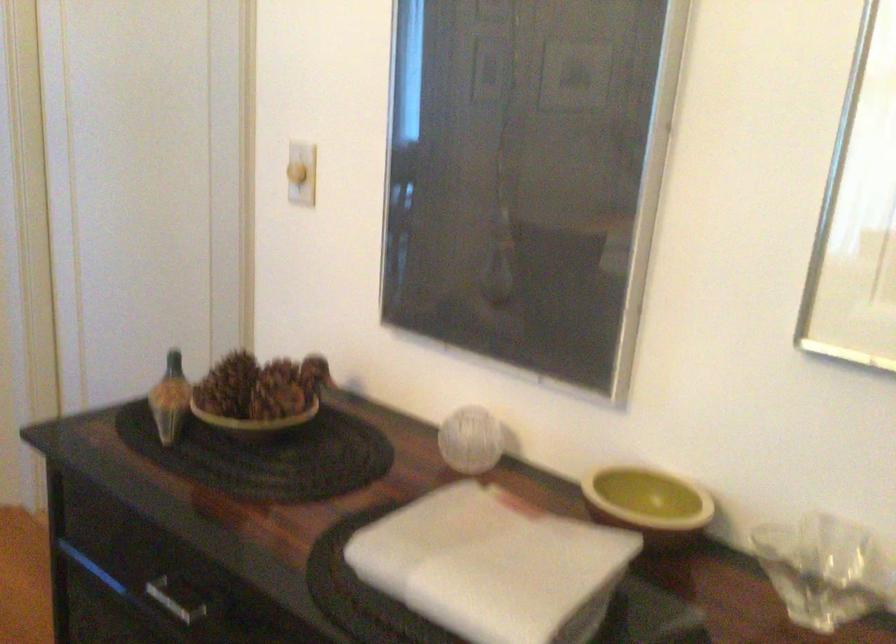
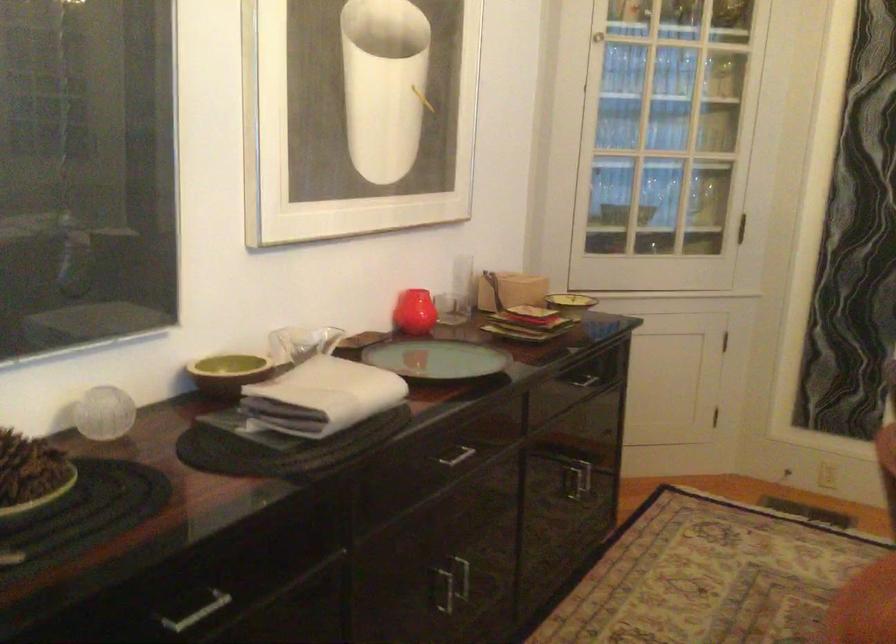
Locate, in the second image, the point that corresponds to (x=596, y=451) in the first image.

(228, 373)